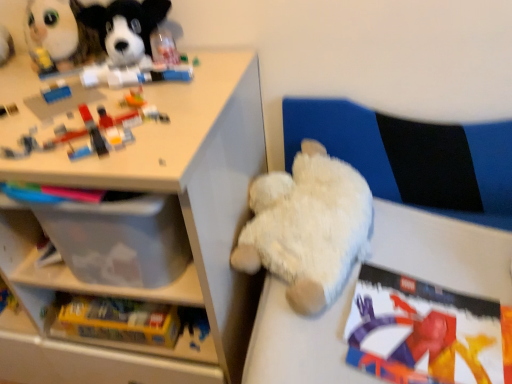
What is the approximate width of matte plastic book at lower right?

The width of matte plastic book at lower right is 10.53 inches.

Describe the element at coordinates (59, 36) in the screenshot. This screenshot has height=384, width=512. I see `fluffy white plush at upper left, the first toy viewed from the left` at that location.

In the scene shown: What is the approximate height of soft plush dog at upper left, the 2th toy when ordered from right to left?

It is 6.32 inches.

Image resolution: width=512 pixels, height=384 pixels. What do you see at coordinates (307, 226) in the screenshot?
I see `white fluffy teddy bear at center, which is counted as the 1th toy, starting from the right` at bounding box center [307, 226].

Where is `matte plastic book at lower right`? matte plastic book at lower right is located at coordinates (425, 332).

Would you say white fluffy teddy bear at center, which is counted as the 1th toy, starting from the right, contains fluffy white plush at upper left, which is the 4th toy in right-to-left order?

No, fluffy white plush at upper left, which is the 4th toy in right-to-left order, is not a part of white fluffy teddy bear at center, which is counted as the 1th toy, starting from the right.

Which is more to the left, white fluffy teddy bear at center, marked as the 4th toy in a left-to-right arrangement, or fluffy white plush at upper left, which is the 4th toy in right-to-left order?

fluffy white plush at upper left, which is the 4th toy in right-to-left order, is more to the left.

From a real-world perspective, is white fluffy teddy bear at center, which is counted as the 1th toy, starting from the right, above or below fluffy white plush at upper left, the first toy viewed from the left?

white fluffy teddy bear at center, which is counted as the 1th toy, starting from the right, is situated lower than fluffy white plush at upper left, the first toy viewed from the left, in the real world.

Consider the image. Is white fluffy teddy bear at center, marked as the 4th toy in a left-to-right arrangement, facing towards fluffy white plush at upper left, the first toy viewed from the left?

No, white fluffy teddy bear at center, marked as the 4th toy in a left-to-right arrangement, is not facing towards fluffy white plush at upper left, the first toy viewed from the left.

From a real-world perspective, is brick-like plastic toys at upper left, the second toy in the left-to-right sequence, located beneath fluffy white plush at upper left, the first toy viewed from the left?

Yes, from a real-world perspective, brick-like plastic toys at upper left, the second toy in the left-to-right sequence, is under fluffy white plush at upper left, the first toy viewed from the left.

From the image's perspective, is brick-like plastic toys at upper left, the third toy viewed from the right, below fluffy white plush at upper left, the first toy viewed from the left?

Yes.

Which is farther, (156, 120) or (72, 14)?

The point (72, 14) is more distant.

Who is taller, brick-like plastic toys at upper left, the third toy viewed from the right, or fluffy white plush at upper left, which is the 4th toy in right-to-left order?

fluffy white plush at upper left, which is the 4th toy in right-to-left order.

Would you consider soft plush dog at upper left, the 2th toy when ordered from right to left, to be distant from white fluffy teddy bear at center, marked as the 4th toy in a left-to-right arrangement?

They are positioned close to each other.

In terms of width, does soft plush dog at upper left, the 2th toy when ordered from right to left, look wider or thinner when compared to white fluffy teddy bear at center, which is counted as the 1th toy, starting from the right?

Clearly, soft plush dog at upper left, the 2th toy when ordered from right to left, has less width compared to white fluffy teddy bear at center, which is counted as the 1th toy, starting from the right.

Is soft plush dog at upper left, the 2th toy when ordered from right to left, located outside white fluffy teddy bear at center, marked as the 4th toy in a left-to-right arrangement?

That's correct, soft plush dog at upper left, the 2th toy when ordered from right to left, is outside of white fluffy teddy bear at center, marked as the 4th toy in a left-to-right arrangement.

How different are the orientations of soft plush dog at upper left, the 3th toy from the left, and white fluffy teddy bear at center, marked as the 4th toy in a left-to-right arrangement, in degrees?

They differ by 4.61 degrees in their facing directions.

Is matte plastic book at lower right inside white plastic shelf at upper left?

No, matte plastic book at lower right is not a part of white plastic shelf at upper left.

Measure the distance between white plastic shelf at upper left and matte plastic book at lower right.

The distance of white plastic shelf at upper left from matte plastic book at lower right is 17.43 inches.

Based on the photo, from the image's perspective, is white plastic shelf at upper left positioned above or below matte plastic book at lower right?

From the image's perspective, white plastic shelf at upper left appears above matte plastic book at lower right.

Which of these two, white plastic shelf at upper left or matte plastic book at lower right, is smaller?

Smaller between the two is matte plastic book at lower right.

How far apart are matte plastic book at lower right and white plastic shelf at upper left?

matte plastic book at lower right is 17.43 inches from white plastic shelf at upper left.

Which point is more distant from viewer, (x=439, y=309) or (x=241, y=110)?

The point (x=241, y=110) is farther from the camera.

Is matte plastic book at lower right looking in the opposite direction of white plastic shelf at upper left?

matte plastic book at lower right does not have its back to white plastic shelf at upper left.

This screenshot has height=384, width=512. There is a fluffy white plush at upper left, the first toy viewed from the left. Identify the location of the 3rd toy below it (from the image's perspective). (307, 226).

Does point (53, 43) lie in front of point (298, 233)?

No, it is behind (298, 233).

What's the angular difference between fluffy white plush at upper left, the first toy viewed from the left, and white fluffy teddy bear at center, which is counted as the 1th toy, starting from the right,'s facing directions?

4.61 degrees.

From a real-world perspective, is fluffy white plush at upper left, which is the 4th toy in right-to-left order, positioned above or below white fluffy teddy bear at center, which is counted as the 1th toy, starting from the right?

In terms of real-world spatial position, fluffy white plush at upper left, which is the 4th toy in right-to-left order, is above white fluffy teddy bear at center, which is counted as the 1th toy, starting from the right.

Can you confirm if fluffy white plush at upper left, which is the 4th toy in right-to-left order, is shorter than matte plastic book at lower right?

In fact, fluffy white plush at upper left, which is the 4th toy in right-to-left order, may be taller than matte plastic book at lower right.

Can you tell me how much fluffy white plush at upper left, which is the 4th toy in right-to-left order, and matte plastic book at lower right differ in facing direction?

11.2 degrees separate the facing orientations of fluffy white plush at upper left, which is the 4th toy in right-to-left order, and matte plastic book at lower right.

Which object is closer to the camera taking this photo, fluffy white plush at upper left, which is the 4th toy in right-to-left order, or matte plastic book at lower right?

Positioned in front is matte plastic book at lower right.

From a real-world perspective, between fluffy white plush at upper left, which is the 4th toy in right-to-left order, and matte plastic book at lower right, who is vertically lower?

In real-world perspective, matte plastic book at lower right is lower.

Where is `the 2nd toy behind the white fluffy teddy bear at center, which is counted as the 1th toy, starting from the right`? This screenshot has width=512, height=384. the 2nd toy behind the white fluffy teddy bear at center, which is counted as the 1th toy, starting from the right is located at coordinates (59, 36).

Where is `toy that is the 2nd object located above the brick-like plastic toys at upper left, the third toy viewed from the right (from the image's perspective)`? Image resolution: width=512 pixels, height=384 pixels. toy that is the 2nd object located above the brick-like plastic toys at upper left, the third toy viewed from the right (from the image's perspective) is located at coordinates (59, 36).

Considering their positions, is matte plastic book at lower right positioned further to fluffy white plush at upper left, which is the 4th toy in right-to-left order, than soft plush dog at upper left, the 3th toy from the left?

Based on the image, matte plastic book at lower right appears to be further to fluffy white plush at upper left, which is the 4th toy in right-to-left order.

Based on their spatial positions, is matte plastic book at lower right or white fluffy teddy bear at center, marked as the 4th toy in a left-to-right arrangement, closer to brick-like plastic toys at upper left, the third toy viewed from the right?

white fluffy teddy bear at center, marked as the 4th toy in a left-to-right arrangement.

From the image, which object appears to be nearer to fluffy white plush at upper left, the first toy viewed from the left, white fluffy teddy bear at center, marked as the 4th toy in a left-to-right arrangement, or matte plastic book at lower right?

white fluffy teddy bear at center, marked as the 4th toy in a left-to-right arrangement.

Estimate the real-world distances between objects in this image. Which object is closer to brick-like plastic toys at upper left, the third toy viewed from the right, soft plush dog at upper left, the 2th toy when ordered from right to left, or white plastic shelf at upper left?

white plastic shelf at upper left is closer to brick-like plastic toys at upper left, the third toy viewed from the right.

Looking at the image, which one is located closer to brick-like plastic toys at upper left, the third toy viewed from the right, soft plush dog at upper left, the 2th toy when ordered from right to left, or fluffy white plush at upper left, the first toy viewed from the left?

soft plush dog at upper left, the 2th toy when ordered from right to left, is positioned closer to the anchor brick-like plastic toys at upper left, the third toy viewed from the right.

Based on their spatial positions, is white plastic shelf at upper left or white fluffy teddy bear at center, marked as the 4th toy in a left-to-right arrangement, further from brick-like plastic toys at upper left, the third toy viewed from the right?

The object further to brick-like plastic toys at upper left, the third toy viewed from the right, is white fluffy teddy bear at center, marked as the 4th toy in a left-to-right arrangement.

Looking at the image, which one is located closer to white fluffy teddy bear at center, which is counted as the 1th toy, starting from the right, white plastic shelf at upper left or soft plush dog at upper left, the 3th toy from the left?

white plastic shelf at upper left.

Considering their positions, is white plastic shelf at upper left positioned further to matte plastic book at lower right than white fluffy teddy bear at center, which is counted as the 1th toy, starting from the right?

Based on the image, white plastic shelf at upper left appears to be further to matte plastic book at lower right.

Find the location of a particular element. The image size is (512, 384). toy that lies between fluffy white plush at upper left, the first toy viewed from the left, and brick-like plastic toys at upper left, the second toy in the left-to-right sequence, from top to bottom is located at coordinates pos(126,28).

Locate an element on the screen. Image resolution: width=512 pixels, height=384 pixels. toy between brick-like plastic toys at upper left, the third toy viewed from the right, and white fluffy teddy bear at center, which is counted as the 1th toy, starting from the right is located at coordinates (126, 28).